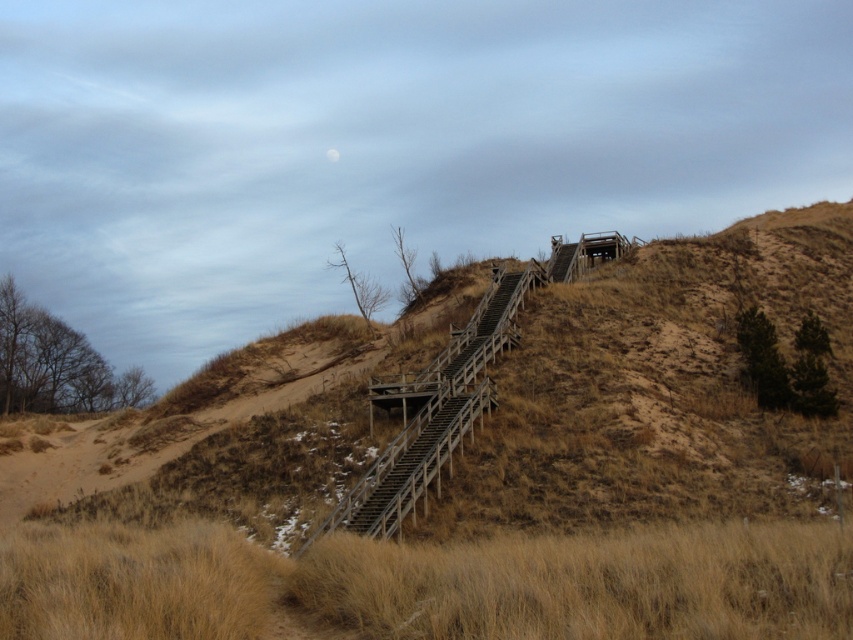
Question: Is brown wooden stairs at center below dry grass at lower center?

Choices:
 (A) no
 (B) yes

Answer: (A)

Question: Which of the following is the farthest from the observer?

Choices:
 (A) brown wooden stairs at center
 (B) dry grass at lower center

Answer: (A)

Question: Does brown wooden stairs at center have a smaller size compared to dry grass at lower center?

Choices:
 (A) yes
 (B) no

Answer: (B)

Question: Is brown wooden stairs at center positioned at the back of dry grass at lower center?

Choices:
 (A) no
 (B) yes

Answer: (B)

Question: Which object appears farthest from the camera in this image?

Choices:
 (A) brown wooden stairs at center
 (B) dry grass at lower center

Answer: (A)

Question: Which point is closer to the camera?

Choices:
 (A) (178, 586)
 (B) (541, 468)

Answer: (A)